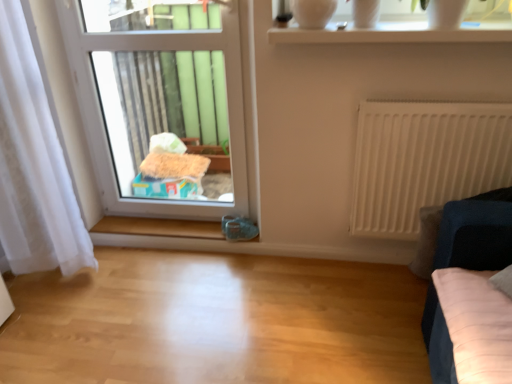
Locate an element on the screen. Image resolution: width=512 pixels, height=384 pixels. free point below transparent plastic window at center, arranged as the 2th window when viewed from the right (from a real-world perspective) is located at coordinates (170, 224).